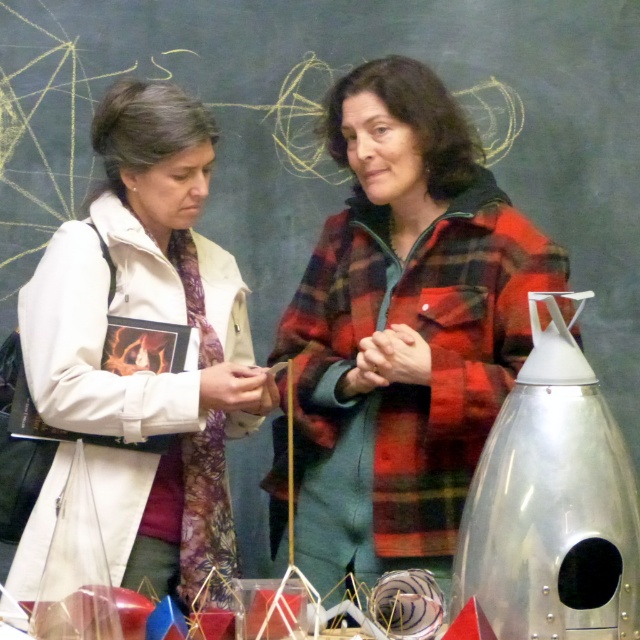
Question: Which object is closer to the camera taking this photo?

Choices:
 (A) white matte jacket at center
 (B) red plaid jacket at center

Answer: (B)

Question: Is red plaid jacket at center wider than white matte jacket at center?

Choices:
 (A) no
 (B) yes

Answer: (B)

Question: Which of the following is the closest to the observer?

Choices:
 (A) red plaid jacket at center
 (B) white matte jacket at center

Answer: (A)

Question: Observing the image, what is the correct spatial positioning of red plaid jacket at center in reference to white matte jacket at center?

Choices:
 (A) right
 (B) left

Answer: (A)

Question: Which of the following is the farthest from the observer?

Choices:
 (A) white matte jacket at center
 (B) red plaid jacket at center

Answer: (A)

Question: Is red plaid jacket at center thinner than white matte jacket at center?

Choices:
 (A) no
 (B) yes

Answer: (A)